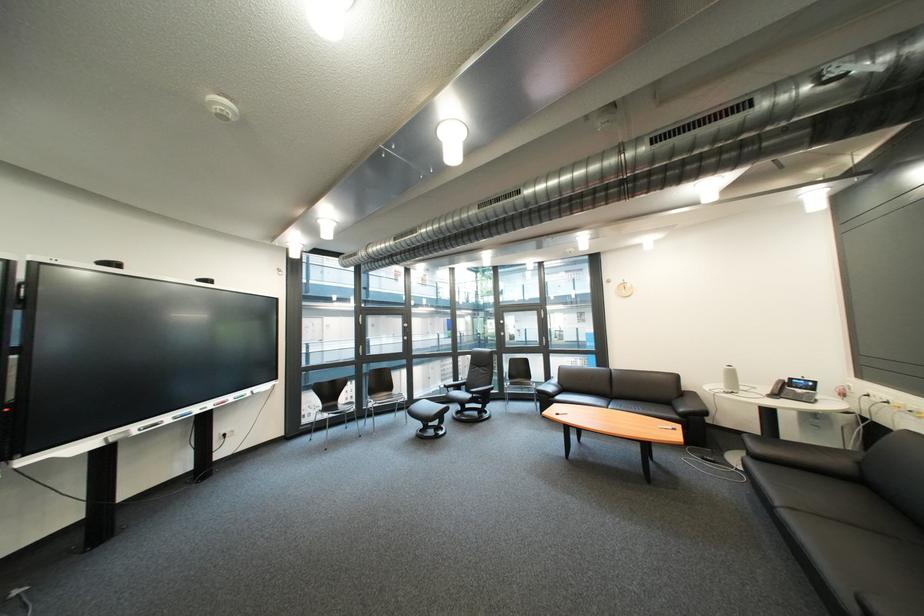
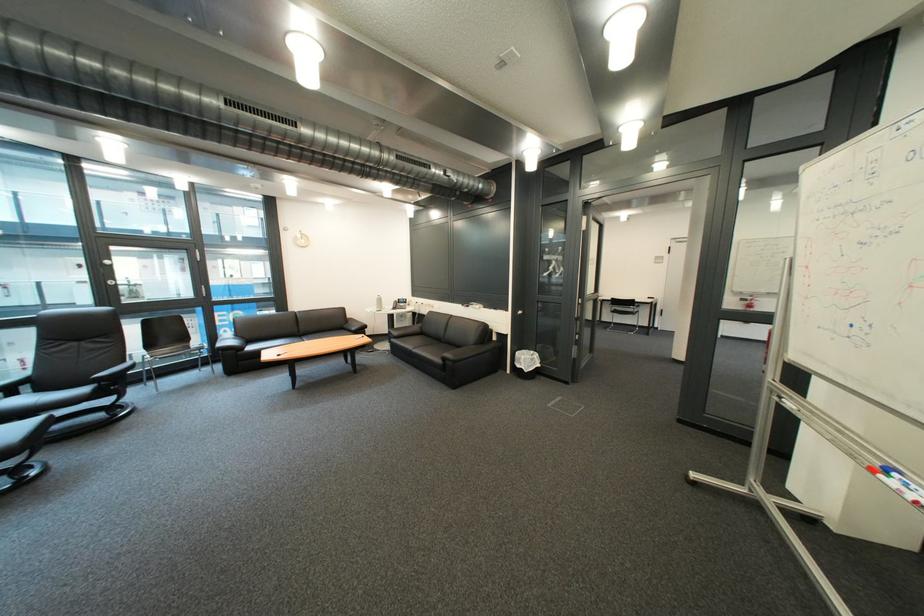
Locate, in the second image, the point that corresponds to pixel 800 516 in the first image.

(429, 353)